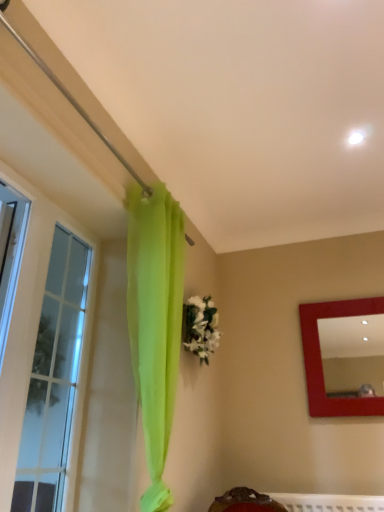
Question: From a real-world perspective, is white matte floral arrangement at center positioned above or below matte red mirror at upper right?

Choices:
 (A) below
 (B) above

Answer: (B)

Question: Is white matte floral arrangement at center inside the boundaries of matte red mirror at upper right, or outside?

Choices:
 (A) outside
 (B) inside

Answer: (A)

Question: Considering the real-world distances, which object is closest to the clear glass window at left?

Choices:
 (A) matte red mirror at upper right
 (B) white matte floral arrangement at center

Answer: (B)

Question: Which object is the closest to the white matte floral arrangement at center?

Choices:
 (A) matte red mirror at upper right
 (B) clear glass window at left

Answer: (B)